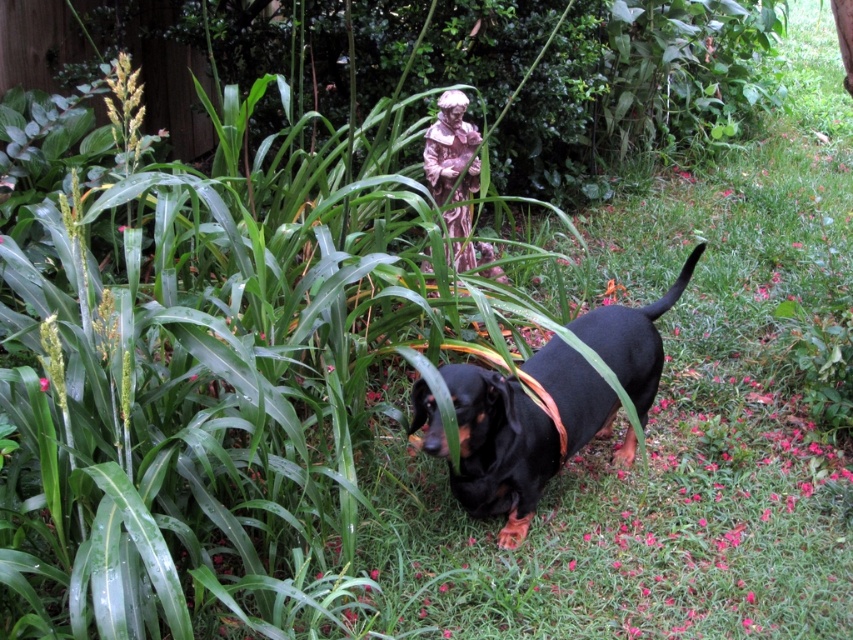
Which is more to the left, black matte dog at center or pink ceramic statue at upper center?

pink ceramic statue at upper center

Is black matte dog at center wider than pink ceramic statue at upper center?

Correct, the width of black matte dog at center exceeds that of pink ceramic statue at upper center.

Who is more forward, (631, 451) or (442, 154)?

Point (631, 451)

At what (x,y) coordinates should I click in order to perform the action: click on black matte dog at center. Please return your answer as a coordinate pair (x, y). The image size is (853, 640). Looking at the image, I should click on (498, 449).